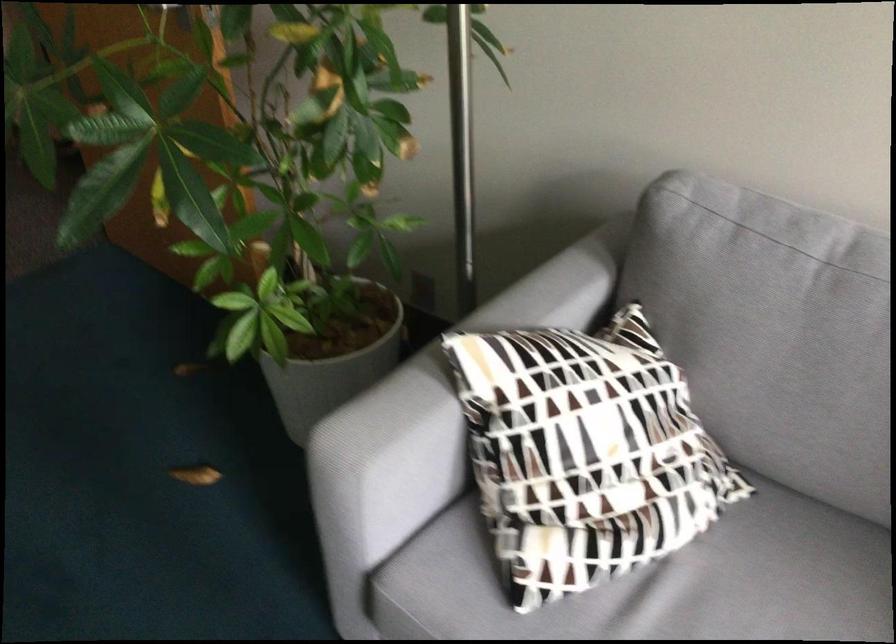
Find where to resting arm the sofa armrest. Please return your answer as a coordinate pair (x, y).

(444, 397)